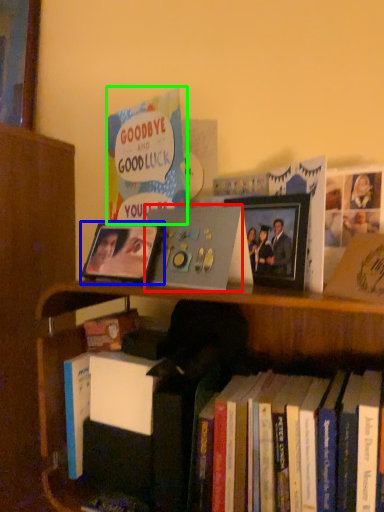
Question: Which is farther away from paperback book (highlighted by a red box)? picture frame (highlighted by a blue box) or book (highlighted by a green box)?

Choices:
 (A) picture frame
 (B) book

Answer: (B)